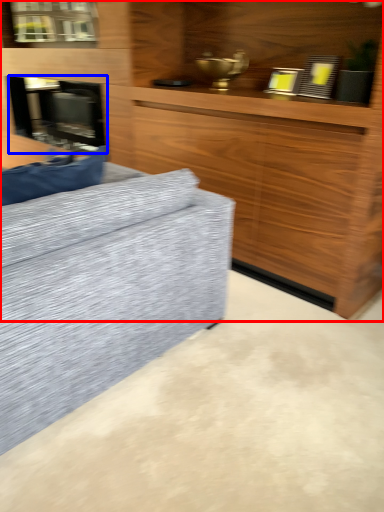
Question: Which point is further to the camera, cabinetry (highlighted by a red box) or fireplace (highlighted by a blue box)?

Choices:
 (A) cabinetry
 (B) fireplace

Answer: (B)